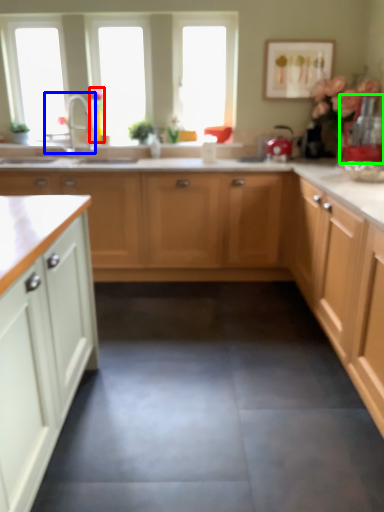
Question: Considering the real-world distances, which object is farthest from flower (highlighted by a red box)? tap (highlighted by a blue box) or appliance (highlighted by a green box)?

Choices:
 (A) tap
 (B) appliance

Answer: (B)